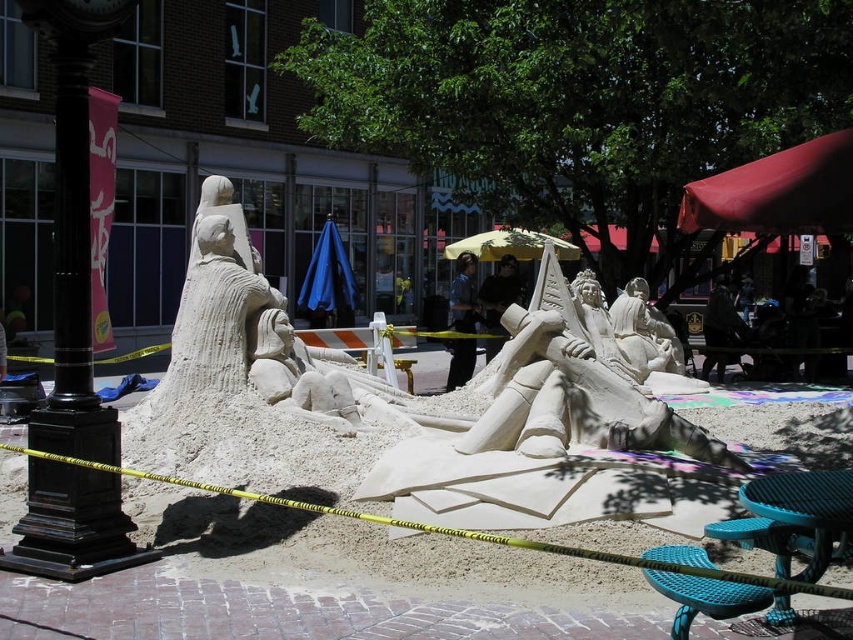
You are a photographer planning to capture the sand sculpture and the objects in the scene. Based on the image, which object, the denim pants at center or the dark fabric bag at lower right, would you need to adjust your camera angle upwards to include in the photo?

The denim pants at center is taller than the dark fabric bag at lower right, so you would need to adjust your camera angle upwards to include the denim pants at center in the photo.

You are a visitor at the plaza and want to know if the yellow fabric umbrella at center can provide shade for someone wearing the dark blue jeans at center. Based on the height of the umbrella and the person, will the umbrella shade them effectively?

The yellow fabric umbrella at center is not as tall as dark blue jeans at center, so the umbrella may not provide sufficient shade for the person wearing the dark blue jeans at center because it is shorter than them.